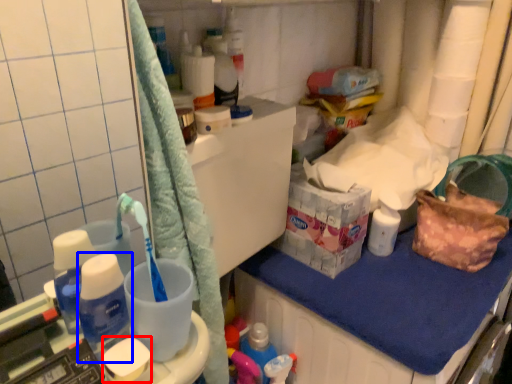
Question: Among these objects, which one is farthest to the camera, soap (highlighted by a red box) or bottle (highlighted by a blue box)?

Choices:
 (A) soap
 (B) bottle

Answer: (A)